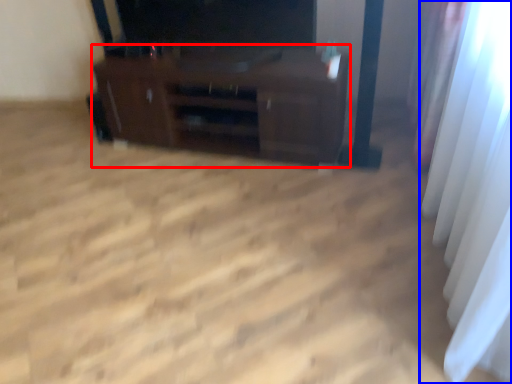
Question: Which point is further to the camera, furniture (highlighted by a red box) or curtain (highlighted by a blue box)?

Choices:
 (A) furniture
 (B) curtain

Answer: (A)